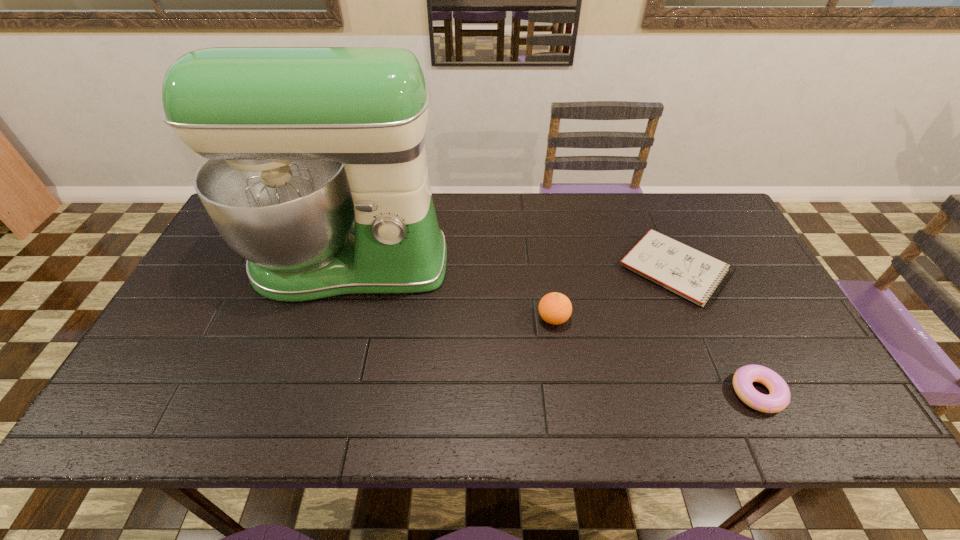
Find the location of `the leftmost object`. the leftmost object is located at coordinates (299, 140).

Locate an element on the screen. The image size is (960, 540). the tallest object is located at coordinates (299, 140).

Where is `the second object from left to right`? the second object from left to right is located at coordinates (555, 308).

The height and width of the screenshot is (540, 960). Find the location of `orange`. orange is located at coordinates (555, 308).

Identify the location of the second shortest object. The image size is (960, 540). (779, 398).

Where is `the nearest object`? This screenshot has height=540, width=960. the nearest object is located at coordinates (779, 398).

Where is `notepad`? The width and height of the screenshot is (960, 540). notepad is located at coordinates (690, 273).

You are a GUI agent. You are given a task and a screenshot of the screen. Output one action in this format:
    pyautogui.click(x=<x>, y=<y>)
    Task: Click on the vacant region located on the controls of the leftmost object
    The image size is (960, 540).
    Given the screenshot: What is the action you would take?
    pyautogui.click(x=317, y=370)

Where is `free space located on the front of the third object from right to left`? The width and height of the screenshot is (960, 540). free space located on the front of the third object from right to left is located at coordinates (570, 434).

What are the coordinates of `vacant area situated 0.050m on the right of the doughnut` in the screenshot? It's located at (804, 393).